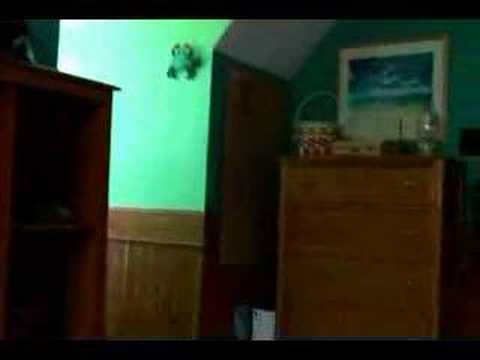
Where is `picutre frame`? picutre frame is located at coordinates (x=445, y=90), (x=402, y=38), (x=340, y=74).